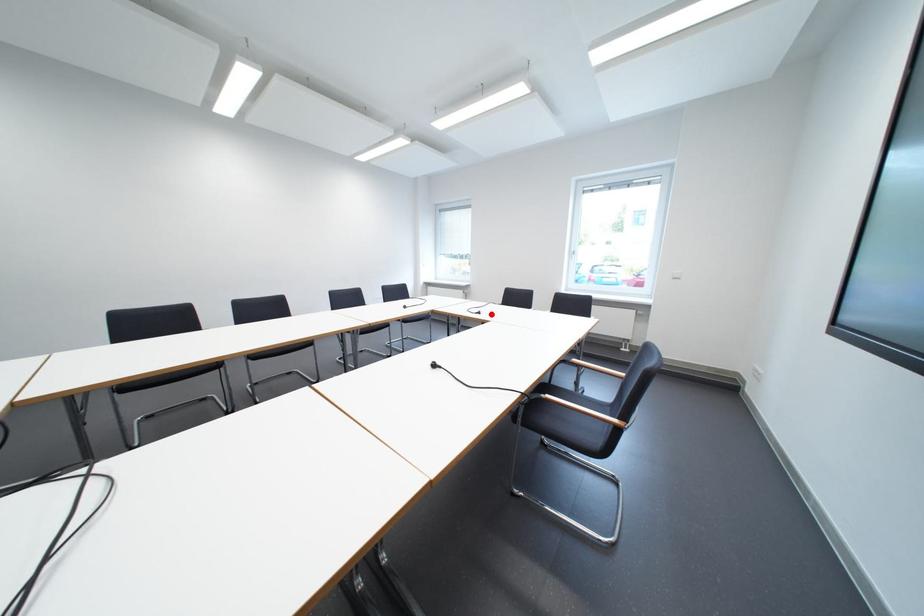
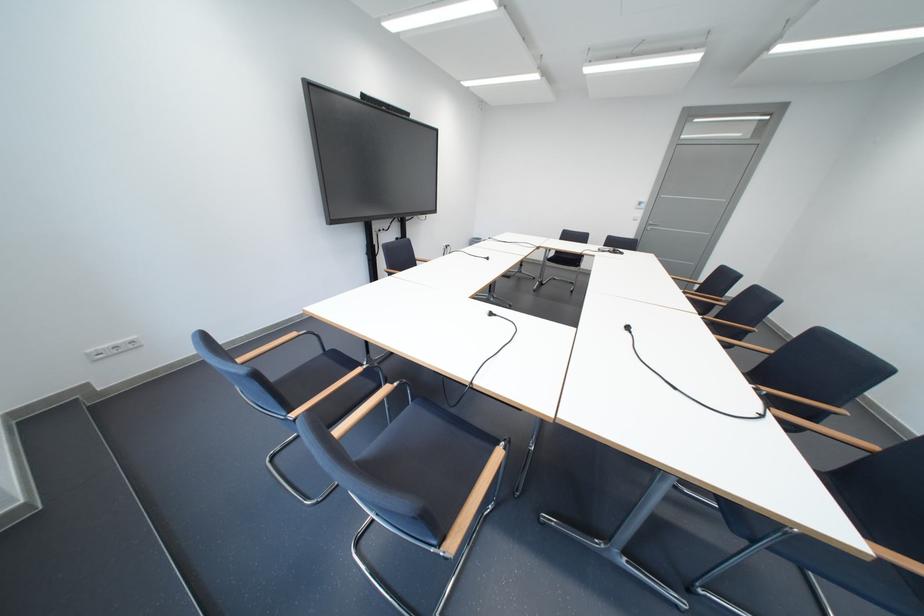
Question: I am providing you with two images of the same scene from different viewpoints. A red point is marked on the first image. Can you still see the location of the red point in image 2?

Choices:
 (A) Yes
 (B) No

Answer: (A)